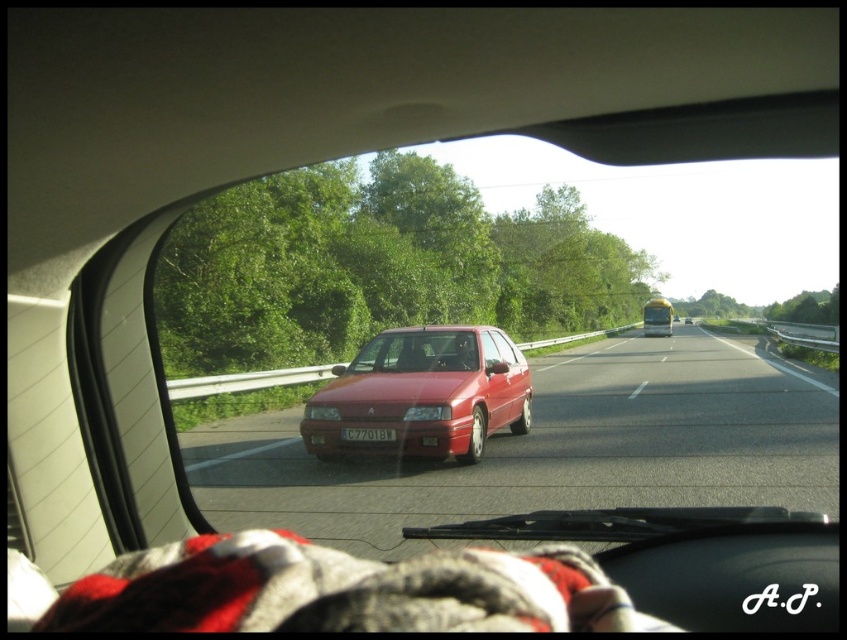
Which is more to the left, glossy red car at center or matte red car at center?

matte red car at center

Consider the image. Does glossy red car at center lie in front of matte red car at center?

Yes, glossy red car at center is closer to the viewer.

Does point (630, 339) lie in front of point (507, 396)?

No.

Find the location of a particular element. The width and height of the screenshot is (847, 640). glossy red car at center is located at coordinates (555, 449).

Does glossy red car at center have a greater height compared to yellow matte license plate at center?

Correct, glossy red car at center is much taller as yellow matte license plate at center.

Can you confirm if glossy red car at center is shorter than yellow matte license plate at center?

In fact, glossy red car at center may be taller than yellow matte license plate at center.

Which is in front, point (346, 524) or point (371, 428)?

Positioned in front is point (346, 524).

Where is `glossy red car at center`? The width and height of the screenshot is (847, 640). glossy red car at center is located at coordinates (555, 449).

Which is below, matte red car at center or yellow matte license plate at center?

yellow matte license plate at center

Image resolution: width=847 pixels, height=640 pixels. I want to click on matte red car at center, so click(422, 394).